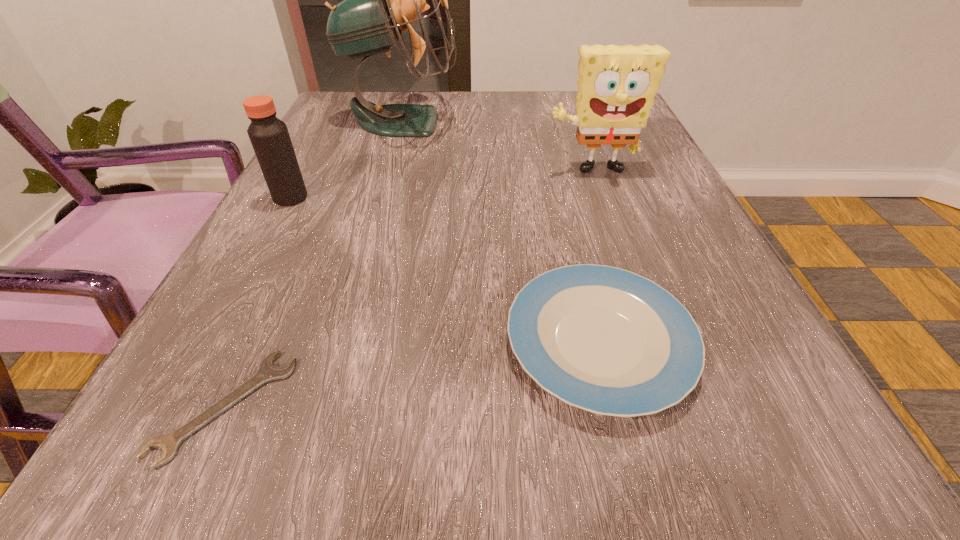
Where is `vacant region located 0.360m on the back of the vinegar`? vacant region located 0.360m on the back of the vinegar is located at coordinates (340, 108).

Locate an element on the screen. This screenshot has height=540, width=960. vacant area located on the back of the second shortest object is located at coordinates (552, 150).

Identify the location of free space located 0.100m on the back of the wrench. The width and height of the screenshot is (960, 540). (276, 296).

Find the location of a particular element. object that is positioned at the far edge is located at coordinates (380, 0).

Find the location of a particular element. plate at the near edge is located at coordinates (606, 340).

What are the coordinates of `wrench positioned at the near edge` in the screenshot? It's located at (170, 442).

This screenshot has width=960, height=540. Identify the location of fan that is at the left edge. (380, 0).

The height and width of the screenshot is (540, 960). I want to click on vinegar that is at the left edge, so click(269, 136).

The image size is (960, 540). I want to click on wrench situated at the left edge, so click(x=170, y=442).

Find the location of a particular element. This screenshot has width=960, height=540. sponge positioned at the right edge is located at coordinates click(617, 84).